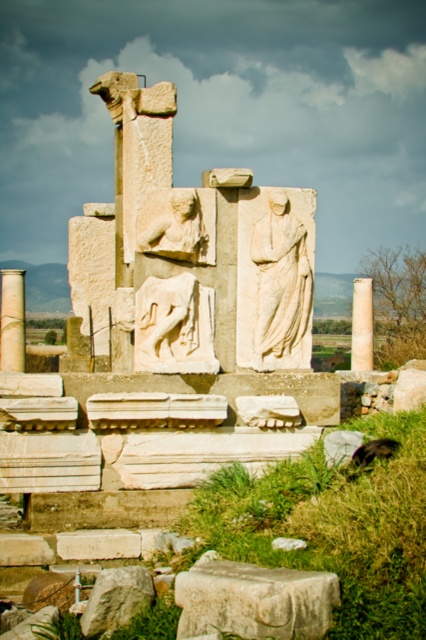
Based on the scene description, where is the white marble statue at center located in terms of coordinates?

The white marble statue at center is located at coordinates point (276, 276).

You are an archaeologist examining the central area of the ancient stone structure. You notice two central sculptures here. Which one is shorter between the white marble horse at center and the matte stone lion at center?

The white marble horse at center is not as tall as the matte stone lion at center, so the white marble horse at center is shorter.

You are an archaeologist examining the ancient stone structure. You notice the white marble horse at center and the matte stone lion at center. Which of these two objects is positioned lower in the structure?

The white marble horse at center is located below the matte stone lion at center, so it is positioned lower in the structure.